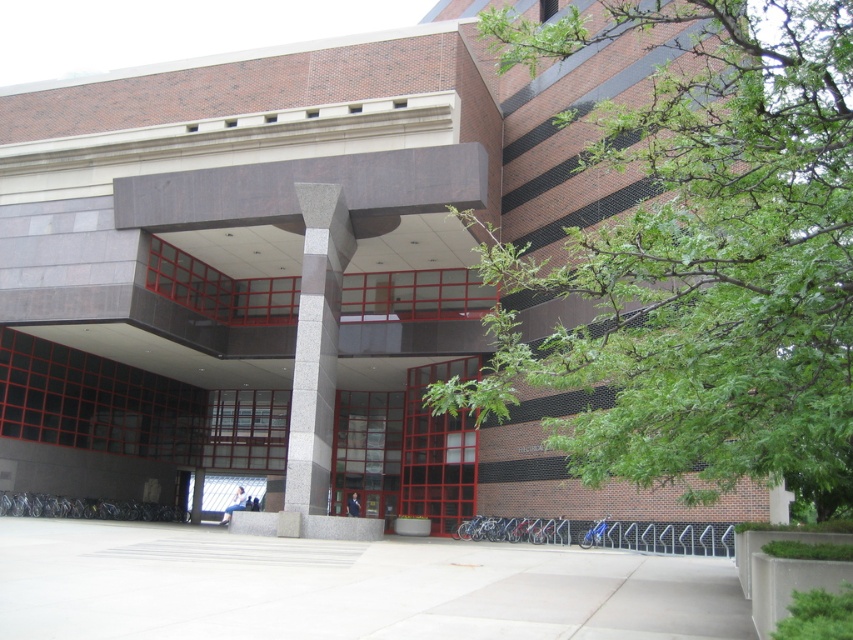
Question: Does red glass door at center come in front of glass door at center?

Choices:
 (A) yes
 (B) no

Answer: (A)

Question: Does granite column at center appear over red glass door at center?

Choices:
 (A) no
 (B) yes

Answer: (B)

Question: Is green leafy tree at upper right wider than glass door at center?

Choices:
 (A) no
 (B) yes

Answer: (B)

Question: Which point appears farthest from the camera in this image?

Choices:
 (A) (339, 465)
 (B) (456, 518)

Answer: (A)

Question: Based on their relative distances, which object is farther from the red glass door at center?

Choices:
 (A) glass door at center
 (B) granite column at center

Answer: (B)

Question: Which object is farther from the camera taking this photo?

Choices:
 (A) granite column at center
 (B) red glass door at center

Answer: (B)